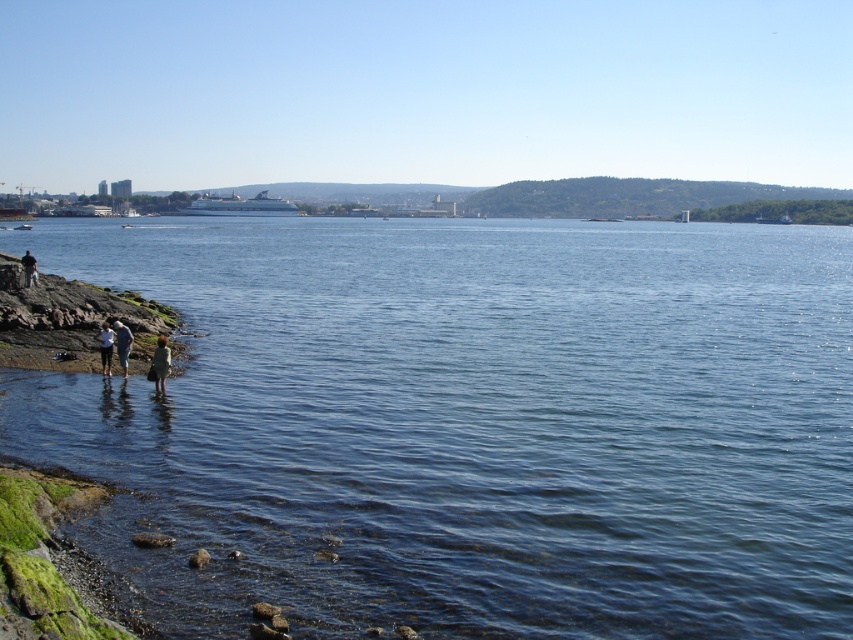
Question: Is blue water at lower left smaller than light brown wooden stick at lower left?

Choices:
 (A) no
 (B) yes

Answer: (A)

Question: Is light brown wooden stick at lower left thinner than dark gray fabric jacket at lower left?

Choices:
 (A) no
 (B) yes

Answer: (B)

Question: Is light brown wooden stick at lower left positioned behind dark gray fabric jacket at lower left?

Choices:
 (A) no
 (B) yes

Answer: (A)

Question: Which object is positioned closest to the white cotton shirt at lower left?

Choices:
 (A) dark gray fabric jacket at lower left
 (B) blue water at lower left
 (C) light brown wooden stick at lower left

Answer: (C)

Question: Which point appears farthest from the camera in this image?

Choices:
 (A) (35, 268)
 (B) (93, 444)
 (C) (119, 323)

Answer: (A)

Question: Which point is closer to the camera?

Choices:
 (A) white cotton shirt at lower left
 (B) green wool coat at lower left
 (C) dark gray fabric jacket at lower left

Answer: (B)